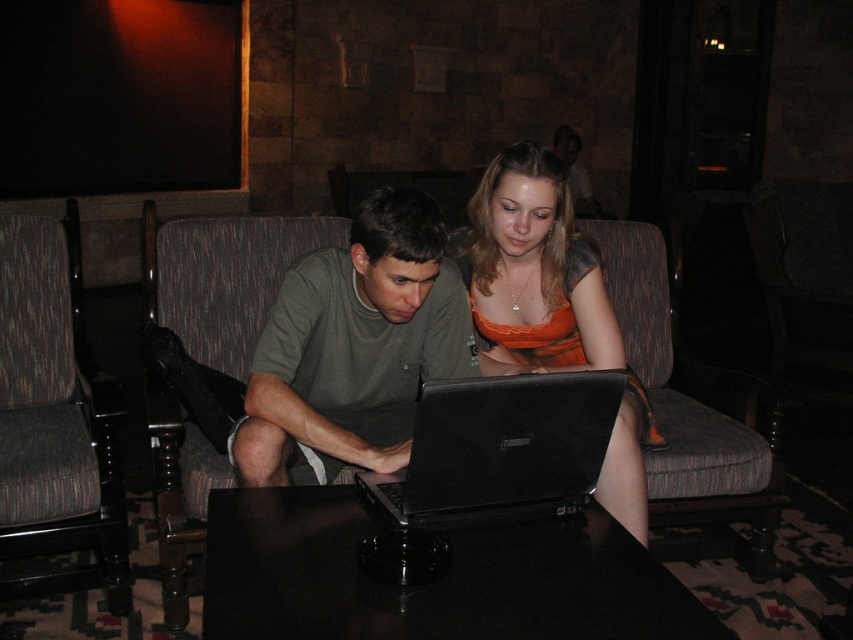
Is matte black laptop at center to the left of green matte shirt at center from the viewer's perspective?

No, matte black laptop at center is not to the left of green matte shirt at center.

Between point (469, 296) and point (442, 352), which one is positioned in front?

Positioned in front is point (442, 352).

The height and width of the screenshot is (640, 853). Find the location of `matte black laptop at center`. matte black laptop at center is located at coordinates (416, 321).

Can you confirm if matte black laptop at center is bigger than dark brown fabric armchair at left?

Yes.

Who is taller, matte black laptop at center or dark brown fabric armchair at left?

With more height is dark brown fabric armchair at left.

Find the location of a particular element. Image resolution: width=853 pixels, height=640 pixels. matte black laptop at center is located at coordinates (416, 321).

Where is `matte black laptop at center`? The width and height of the screenshot is (853, 640). matte black laptop at center is located at coordinates (416, 321).

Between matte black laptop at center and orange satin dress at center, which one has less height?

matte black laptop at center

Which is more to the right, matte black laptop at center or orange satin dress at center?

orange satin dress at center

Is point (457, 298) behind point (524, 326)?

No.

At what (x,y) coordinates should I click in order to perform the action: click on matte black laptop at center. Please return your answer as a coordinate pair (x, y). The width and height of the screenshot is (853, 640). Looking at the image, I should click on (416, 321).